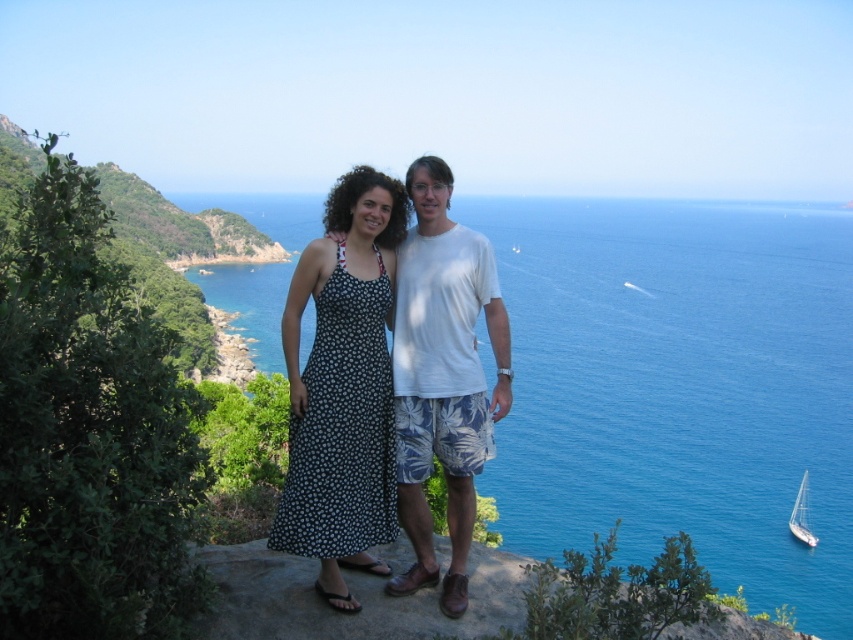
You are a photographer planning to capture a portrait of two people standing on a rocky outcrop. You notice the black floral dress at center and the white cotton shirt at center. Which clothing item should you focus on to ensure it appears larger in the photo?

The black floral dress at center is in front of the white cotton shirt at center, so focusing on it will make it appear larger in the photo due to its closer proximity to the camera.

You are a photographer planning to capture a sunset shot from the rocky outcrop where the two people are standing. You want to ensure the blue liquid water at center and the white glossy sailboat at lower right are both visible in the frame. Based on their positions, will the sailboat be partially hidden by the water?

The blue liquid water at center is located above the white glossy sailboat at lower right, so the sailboat will be partially hidden by the water in the photograph.